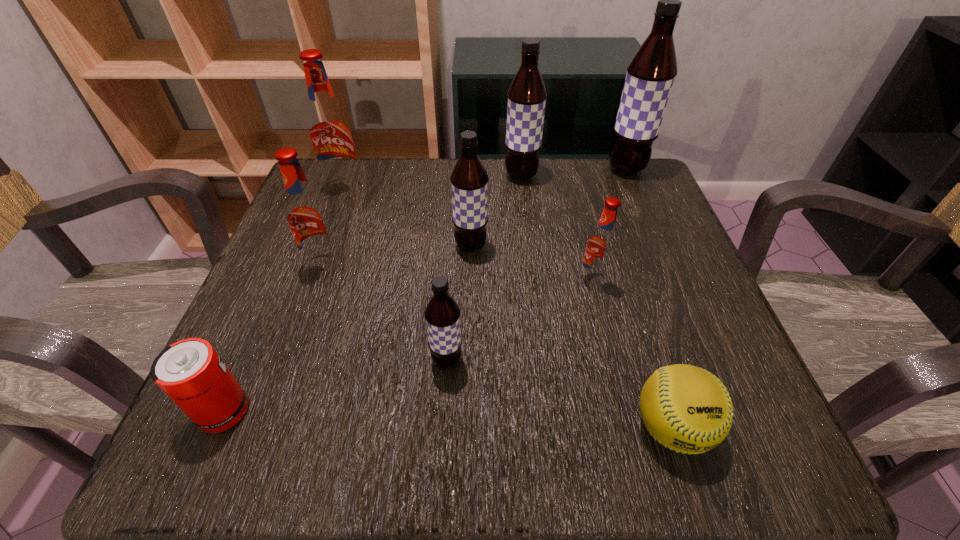
Find the location of a particular element. This screenshot has width=960, height=540. the nearest root beer is located at coordinates (442, 313).

Where is `can`? This screenshot has width=960, height=540. can is located at coordinates (190, 372).

Locate an element on the screen. The width and height of the screenshot is (960, 540). softball is located at coordinates (687, 409).

This screenshot has height=540, width=960. Find the location of `the shortest object`. the shortest object is located at coordinates (687, 409).

Identify the location of free region located 0.270m on the front of the rightmost root beer. The height and width of the screenshot is (540, 960). click(x=664, y=261).

The image size is (960, 540). I want to click on free region located on the left of the third smallest brown root beer, so click(x=398, y=176).

Where is `free space located on the right of the farthest red root beer`? The image size is (960, 540). free space located on the right of the farthest red root beer is located at coordinates (481, 190).

This screenshot has width=960, height=540. I want to click on free region located on the front of the second nearest brown root beer, so click(467, 432).

Identify the location of blank space located on the back of the second biggest red root beer. This screenshot has width=960, height=540. (349, 190).

Identify the location of vacant space located 0.350m on the left of the smallest red root beer. (389, 280).